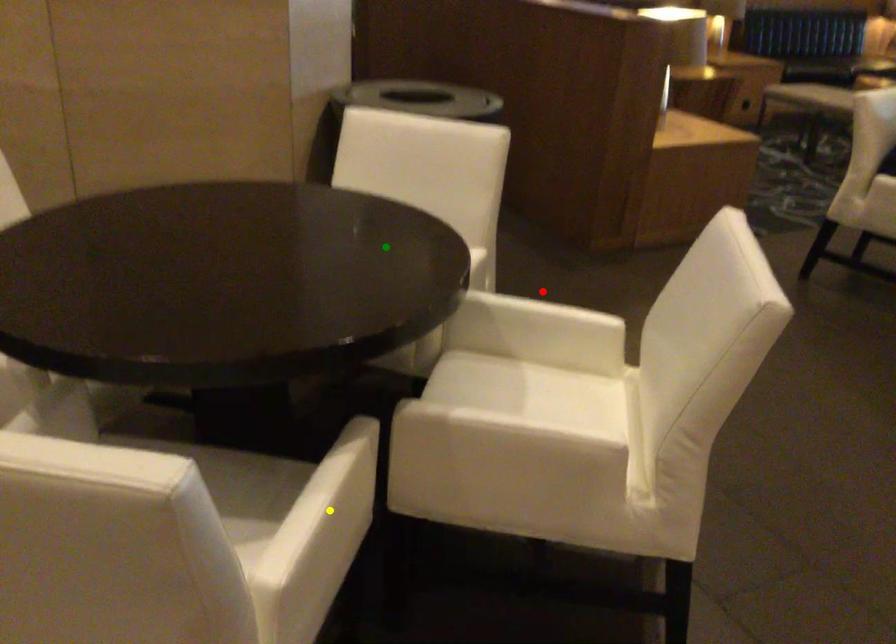
Order these from nearest to farthest:
yellow point, green point, red point

yellow point → green point → red point